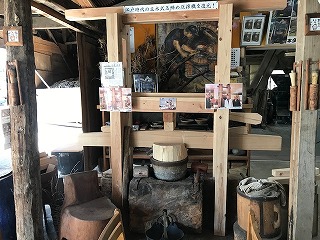
Locate an element on the screen. The width and height of the screenshot is (320, 240). framed picture is located at coordinates (309, 30), (249, 11), (20, 37).